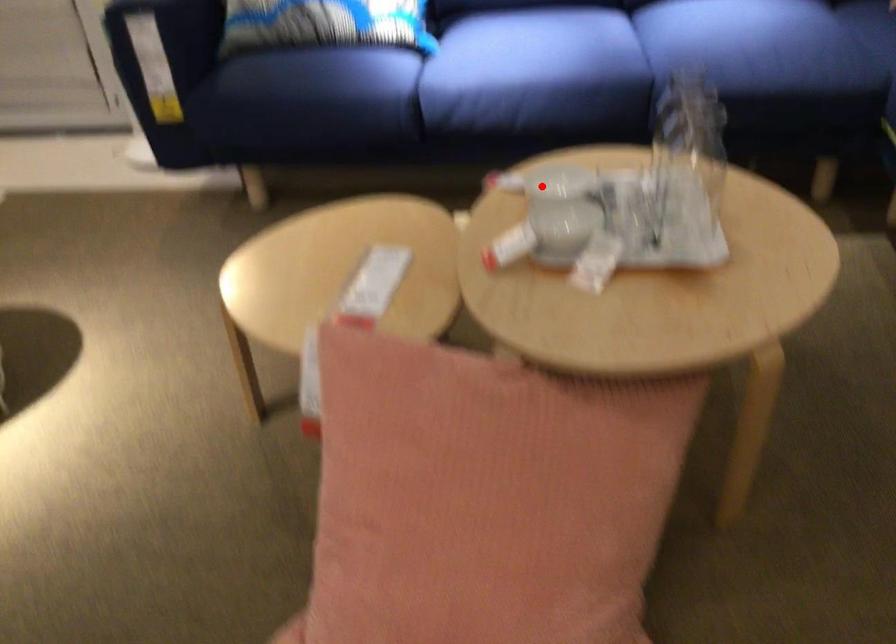
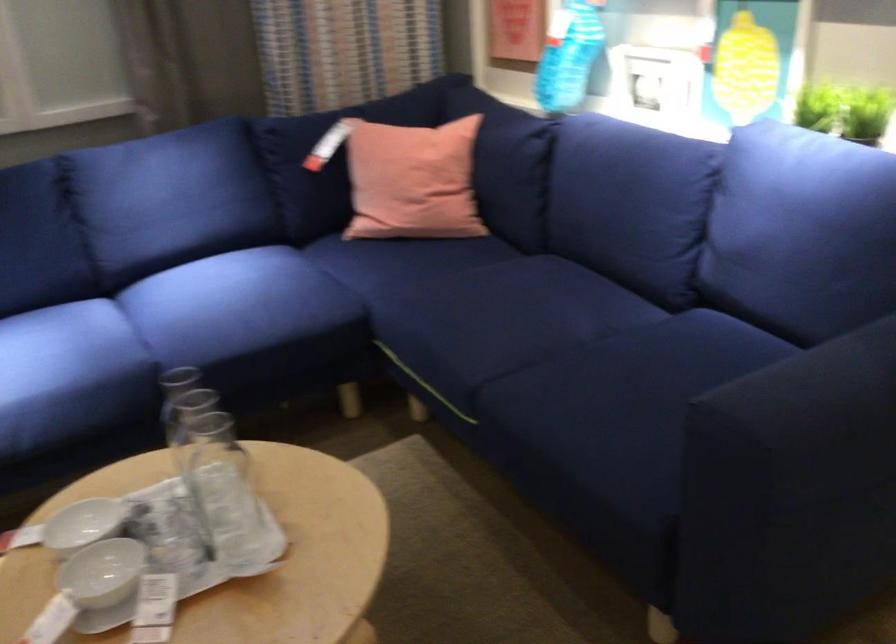
Question: I am providing you with two images of the same scene from different viewpoints. Given a red point in image1, look at the same physical point in image2. Is it:

Choices:
 (A) Closer to the viewpoint
 (B) Farther from the viewpoint

Answer: (A)